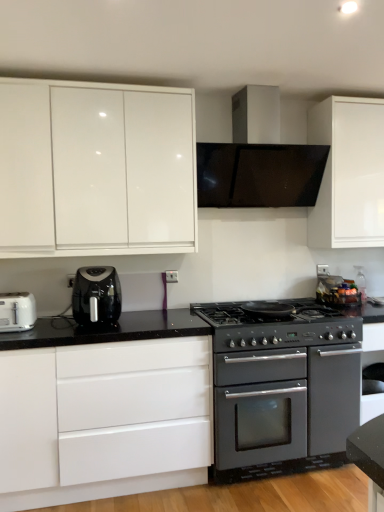
Question: Is black matte gas stove at center outside of glossy white cabinet at upper left, positioned as the 2th cabinetry in bottom-to-top order?

Choices:
 (A) no
 (B) yes

Answer: (B)

Question: From a real-world perspective, is black matte gas stove at center located beneath glossy white cabinet at upper left, which is the first cabinetry in top-to-bottom order?

Choices:
 (A) no
 (B) yes

Answer: (B)

Question: Is glossy white cabinet at upper left, which is the first cabinetry in top-to-bottom order, at the back of black matte gas stove at center?

Choices:
 (A) yes
 (B) no

Answer: (B)

Question: Does black matte gas stove at center lie behind glossy white cabinet at upper left, positioned as the 2th cabinetry in bottom-to-top order?

Choices:
 (A) no
 (B) yes

Answer: (B)

Question: Does black matte gas stove at center appear on the right side of glossy white cabinet at upper left, which is the first cabinetry in top-to-bottom order?

Choices:
 (A) yes
 (B) no

Answer: (A)

Question: Considering the relative sizes of black matte gas stove at center and glossy white cabinet at upper left, positioned as the 2th cabinetry in bottom-to-top order, in the image provided, is black matte gas stove at center bigger than glossy white cabinet at upper left, positioned as the 2th cabinetry in bottom-to-top order,?

Choices:
 (A) no
 (B) yes

Answer: (A)

Question: Is the position of black plastic air fryer at left more distant than that of black matte gas stove at center?

Choices:
 (A) no
 (B) yes

Answer: (A)

Question: Does black plastic air fryer at left turn towards black matte gas stove at center?

Choices:
 (A) no
 (B) yes

Answer: (A)

Question: Is black plastic air fryer at left thinner than black matte gas stove at center?

Choices:
 (A) yes
 (B) no

Answer: (A)

Question: Is black plastic air fryer at left smaller than black matte gas stove at center?

Choices:
 (A) no
 (B) yes

Answer: (B)

Question: From a real-world perspective, is black plastic air fryer at left located higher than black matte gas stove at center?

Choices:
 (A) yes
 (B) no

Answer: (A)

Question: Considering the relative sizes of black plastic air fryer at left and black matte gas stove at center in the image provided, is black plastic air fryer at left shorter than black matte gas stove at center?

Choices:
 (A) no
 (B) yes

Answer: (A)

Question: From a real-world perspective, is black plastic air fryer at left physically above matte black oven at center?

Choices:
 (A) yes
 (B) no

Answer: (A)